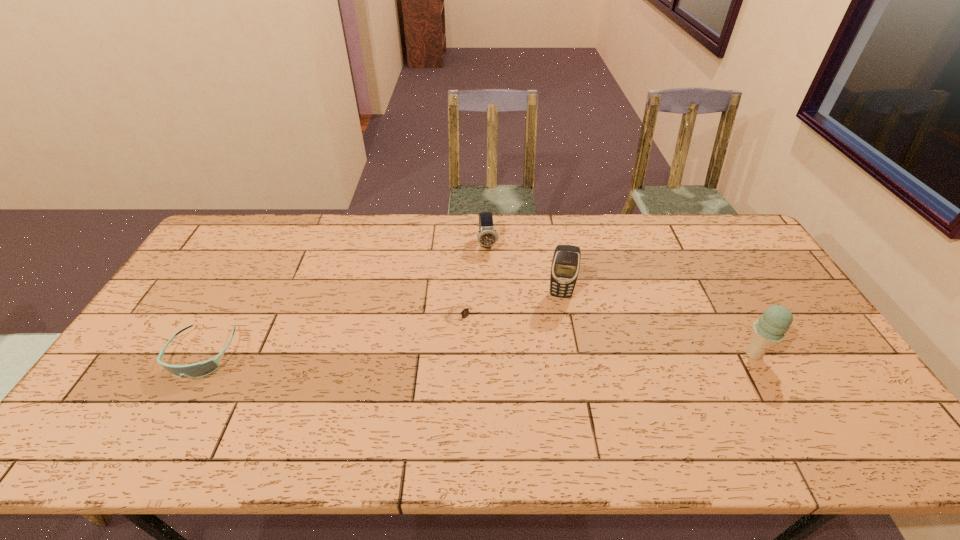
Locate an element on the screen. This screenshot has height=540, width=960. vacant area situated on the face of the third shortest object is located at coordinates (495, 299).

This screenshot has height=540, width=960. Find the location of `vacant area located on the face of the third shortest object`. vacant area located on the face of the third shortest object is located at coordinates (494, 289).

Identify the location of vacant space located 0.290m on the face of the third shortest object. Image resolution: width=960 pixels, height=540 pixels. (498, 318).

I want to click on vacant space located on the face of the nearer watch, so click(540, 373).

I want to click on vacant space located 0.270m on the face of the nearer watch, so pyautogui.click(x=549, y=380).

The width and height of the screenshot is (960, 540). What are the coordinates of `vacant space situated 0.220m on the face of the nearer watch` in the screenshot? It's located at (535, 368).

The image size is (960, 540). In order to click on free space located 0.320m on the front face of the fourth object from left to right in this screenshot , I will do `click(558, 390)`.

Identify the location of vacant region located on the front face of the fourth object from left to right. (558, 407).

This screenshot has width=960, height=540. In order to click on free space located on the front face of the fourth object from left to right in this screenshot , I will do `click(559, 352)`.

Locate an element on the screen. Image resolution: width=960 pixels, height=540 pixels. object located in the far edge section of the desktop is located at coordinates (486, 236).